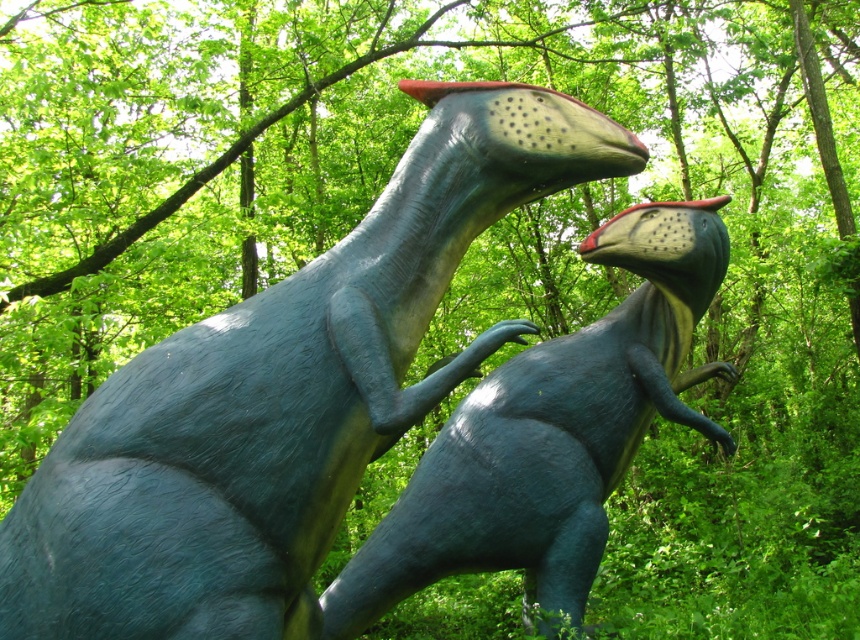
You are a visitor at a park and see two dinosaurs, the matte blue dinosaur at center and the shiny blue dinosaur at center. Which one is located to the left of the other?

The matte blue dinosaur at center is positioned on the left side of shiny blue dinosaur at center.

You are standing at the origin point of the coordinate system. The forest has a coordinate grid overlay. You need to locate the matte blue dinosaur at center. What are its coordinates?

The matte blue dinosaur at center is located at coordinates point [281,397].

You are standing in a forest and see the matte blue dinosaur at center. If you want to get to the dinosaur within 2 seconds, what is the minimum speed you need to move at?

The matte blue dinosaur at center is 6.77 feet away. To reach it in 2 seconds, you need to move at a minimum speed of 3.385 feet per second.